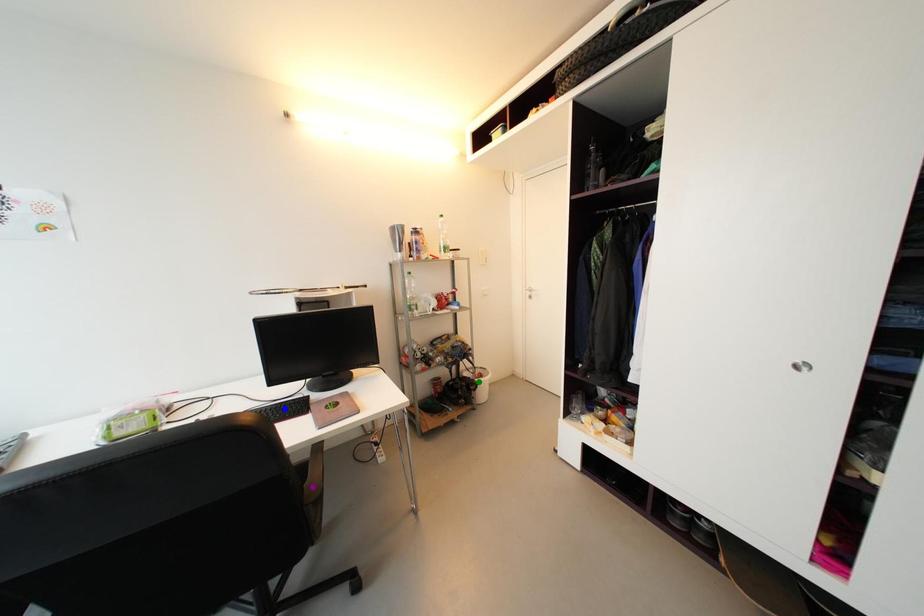
Order these from farthest to nearest:
blue point | green point | purple point

green point < blue point < purple point